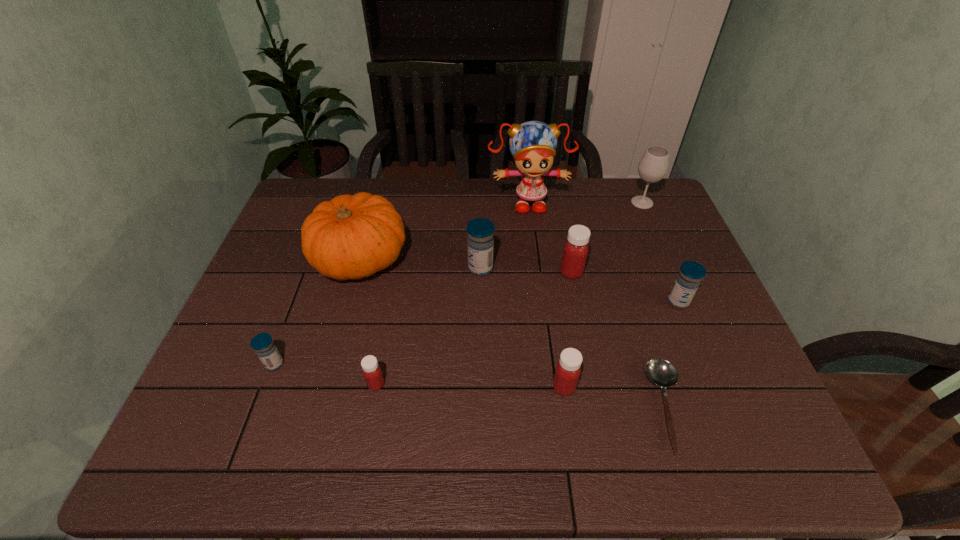
This screenshot has height=540, width=960. I want to click on vacant region that satisfies the following two spatial constraints: 1. on the back side of the third medicine from right to left; 2. on the left side of the rightmost blue medicine, so click(551, 301).

You are a GUI agent. You are given a task and a screenshot of the screen. Output one action in this format:
    pyautogui.click(x=<x>, y=<y>)
    Task: Click on the vacant region that satisfies the following two spatial constraints: 1. on the face of the second smallest red medicine; 2. on the right side of the doll
    Image resolution: width=960 pixels, height=540 pixels.
    Given the screenshot: What is the action you would take?
    pyautogui.click(x=551, y=387)

Locate an element on the screen. The image size is (960, 540). free spot that satisfies the following two spatial constraints: 1. on the back side of the fifth medicine from left to right; 2. on the left side of the third medicine from right to left is located at coordinates (547, 273).